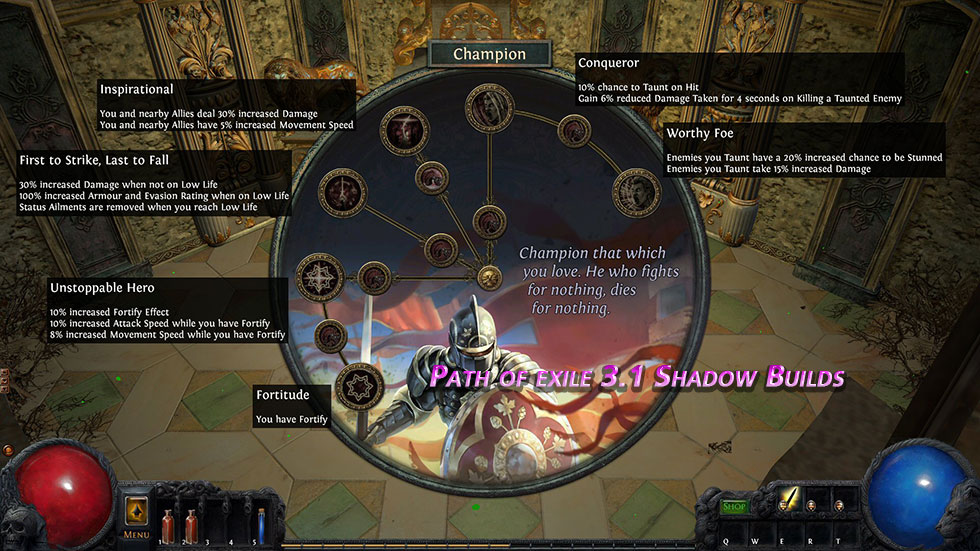
The width and height of the screenshot is (980, 551). I want to click on wall, so click(x=136, y=56).